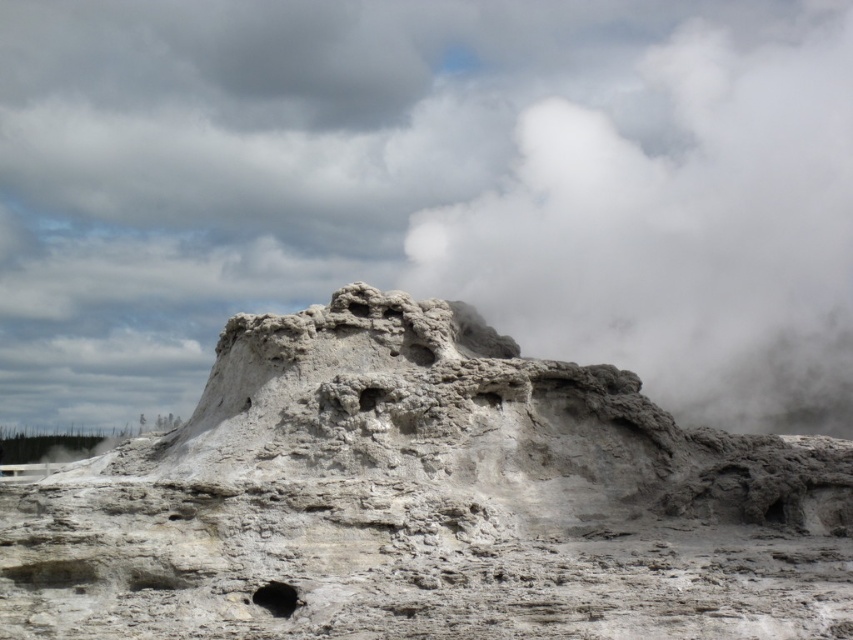
In the scene shown: Who is taller, gray stone rock formation at center or black matte hole at lower center?

gray stone rock formation at center is taller.

Is point (376, 497) positioned in front of point (293, 593)?

That is False.

At what (x,y) coordinates should I click in order to perform the action: click on gray stone rock formation at center. Please return your answer as a coordinate pair (x, y). The height and width of the screenshot is (640, 853). Looking at the image, I should click on (428, 500).

Who is lower down, white fluffy cloud at upper center or black matte hole at lower center?

black matte hole at lower center is below.

Is white fluffy cloud at upper center thinner than black matte hole at lower center?

Incorrect, white fluffy cloud at upper center's width is not less than black matte hole at lower center's.

The width and height of the screenshot is (853, 640). What are the coordinates of `white fluffy cloud at upper center` in the screenshot? It's located at (430, 189).

Does white fluffy cloud at upper center come behind gray stone rock formation at center?

Yes, it is behind gray stone rock formation at center.

Consider the image. Does white fluffy cloud at upper center have a greater width compared to gray stone rock formation at center?

Yes.

Identify the location of white fluffy cloud at upper center. (430, 189).